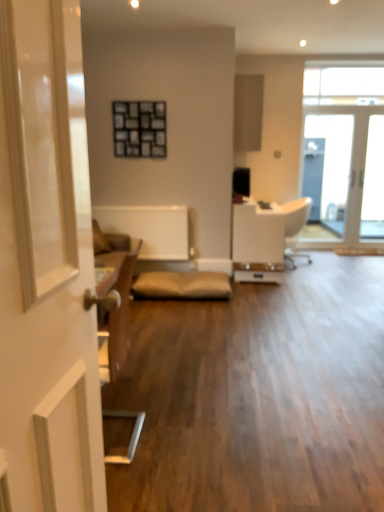
Question: Are clear glass door at upper right, which is the first window in bottom-to-top order, and white leather armchair at center far apart?

Choices:
 (A) no
 (B) yes

Answer: (B)

Question: Is clear glass door at upper right, which is the first window in bottom-to-top order, outside of white leather armchair at center?

Choices:
 (A) yes
 (B) no

Answer: (A)

Question: Does clear glass door at upper right, which is the first window in bottom-to-top order, have a greater height compared to white leather armchair at center?

Choices:
 (A) no
 (B) yes

Answer: (B)

Question: Is clear glass door at upper right, which is the first window in bottom-to-top order, bigger than white leather armchair at center?

Choices:
 (A) yes
 (B) no

Answer: (B)

Question: Is clear glass door at upper right, marked as the second window in a top-to-bottom arrangement, shorter than white leather armchair at center?

Choices:
 (A) no
 (B) yes

Answer: (A)

Question: Is clear glass door at upper right, which is the first window in bottom-to-top order, thinner than white leather armchair at center?

Choices:
 (A) yes
 (B) no

Answer: (A)

Question: From the image's perspective, is white glossy door at left located above transparent glass window at upper right, which ranks as the 1th window in top-to-bottom order?

Choices:
 (A) yes
 (B) no

Answer: (B)

Question: Is white glossy door at left turned away from transparent glass window at upper right, arranged as the second window when ordered from the bottom?

Choices:
 (A) no
 (B) yes

Answer: (A)

Question: From a real-world perspective, is white glossy door at left positioned over transparent glass window at upper right, arranged as the second window when ordered from the bottom, based on gravity?

Choices:
 (A) no
 (B) yes

Answer: (A)

Question: Is white glossy door at left positioned behind transparent glass window at upper right, which ranks as the 1th window in top-to-bottom order?

Choices:
 (A) no
 (B) yes

Answer: (A)

Question: Does white glossy door at left contain transparent glass window at upper right, which ranks as the 1th window in top-to-bottom order?

Choices:
 (A) no
 (B) yes

Answer: (A)

Question: Can you confirm if white glossy door at left is positioned to the right of transparent glass window at upper right, arranged as the second window when ordered from the bottom?

Choices:
 (A) no
 (B) yes

Answer: (A)

Question: Is matte wood cabinet at upper center not within white leather armchair at center?

Choices:
 (A) no
 (B) yes

Answer: (B)